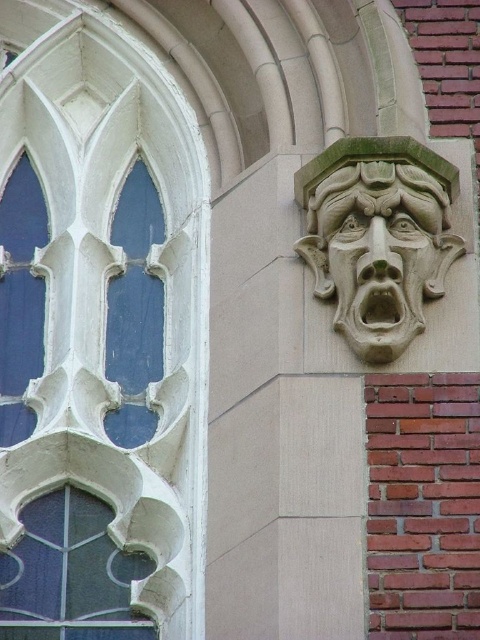
Is white stone window at upper left closer to the viewer compared to stone carved face at upper right?

Yes.

Between white stone window at upper left and stone carved face at upper right, which one has more height?

white stone window at upper left is taller.

What are the coordinates of `white stone window at upper left` in the screenshot? It's located at (98, 333).

Between white stone window at upper left and carved stone face at upper right, which one appears on the right side from the viewer's perspective?

carved stone face at upper right is more to the right.

Can you confirm if white stone window at upper left is thinner than carved stone face at upper right?

No, white stone window at upper left is not thinner than carved stone face at upper right.

Image resolution: width=480 pixels, height=640 pixels. What are the coordinates of `white stone window at upper left` in the screenshot? It's located at point(98,333).

Between stone carved face at upper right and dark blue glass at lower left, which one has more height?

With more height is stone carved face at upper right.

Is stone carved face at upper right smaller than dark blue glass at lower left?

No.

Which is behind, point (376, 332) or point (7, 625)?

Positioned behind is point (7, 625).

What are the coordinates of `stone carved face at upper right` in the screenshot? It's located at (377, 237).